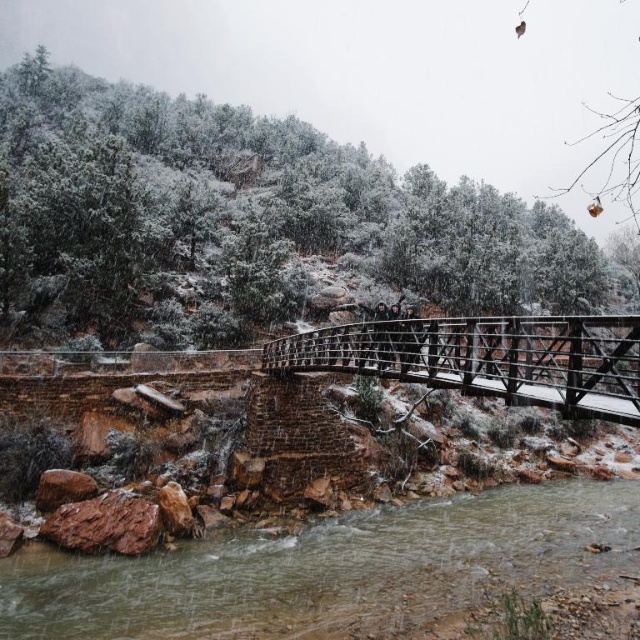
Is clear water at lower left closer to the viewer compared to wooden bridge at center?

No.

Who is more forward, (440, 556) or (525, 353)?

Positioned in front is point (525, 353).

The height and width of the screenshot is (640, 640). In order to click on clear water at lower left in this screenshot , I will do `click(330, 570)`.

Who is more forward, (x=413, y=328) or (x=376, y=308)?

Positioned in front is point (x=413, y=328).

How distant is dark brown leather jacket at center from dark gray fabric jacket at center?

dark brown leather jacket at center and dark gray fabric jacket at center are 6.14 feet apart.

Locate an element on the screen. dark brown leather jacket at center is located at coordinates [410, 339].

Who is higher up, wooden bridge at center or dark gray fabric jacket at center?

dark gray fabric jacket at center

Does wooden bridge at center appear on the right side of dark gray fabric jacket at center?

Yes, wooden bridge at center is to the right of dark gray fabric jacket at center.

What do you see at coordinates (492, 358) in the screenshot? The height and width of the screenshot is (640, 640). I see `wooden bridge at center` at bounding box center [492, 358].

Where is `wooden bridge at center`? wooden bridge at center is located at coordinates (492, 358).